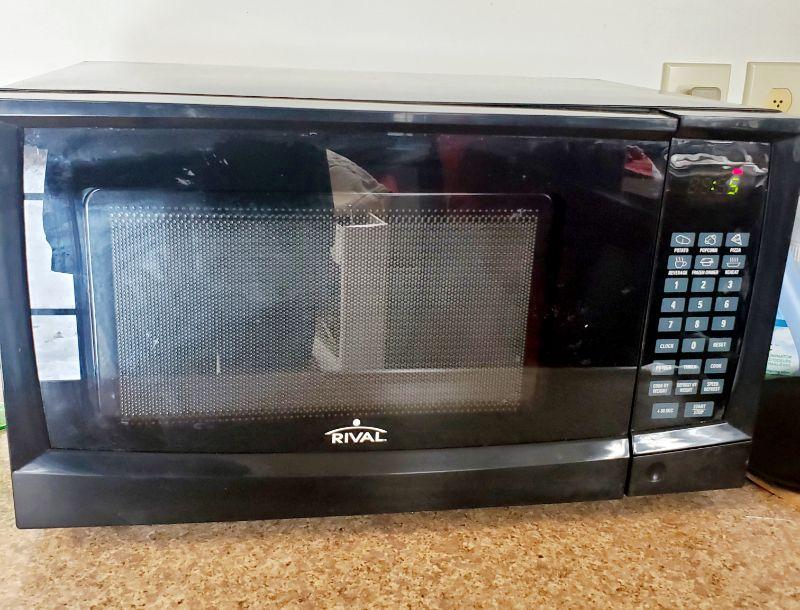
Locate an element on the screen. This screenshot has height=610, width=800. keys is located at coordinates (706, 289).